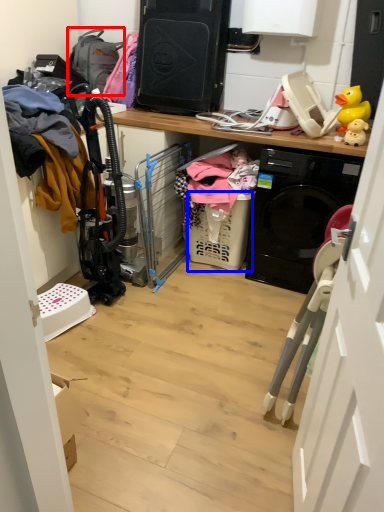
Question: Which of the following is the farthest to the observer, backpack (highlighted by a red box) or basket (highlighted by a blue box)?

Choices:
 (A) backpack
 (B) basket

Answer: (A)